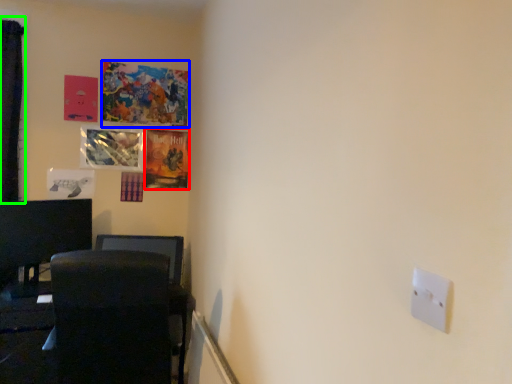
Question: Estimate the real-world distances between objects in this image. Which object is farther from picture frame (highlighted by a red box), picture frame (highlighted by a blue box) or curtain (highlighted by a green box)?

Choices:
 (A) picture frame
 (B) curtain

Answer: (B)